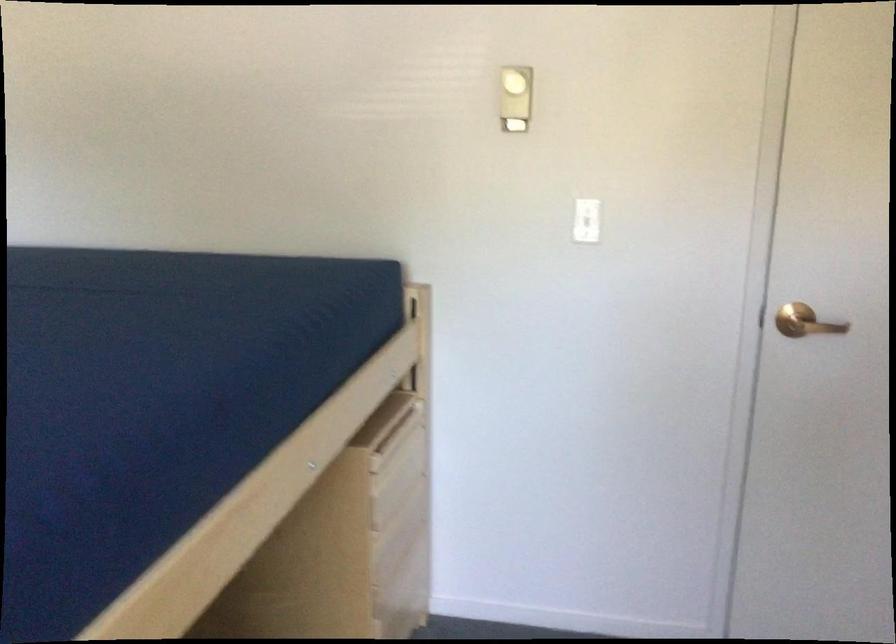
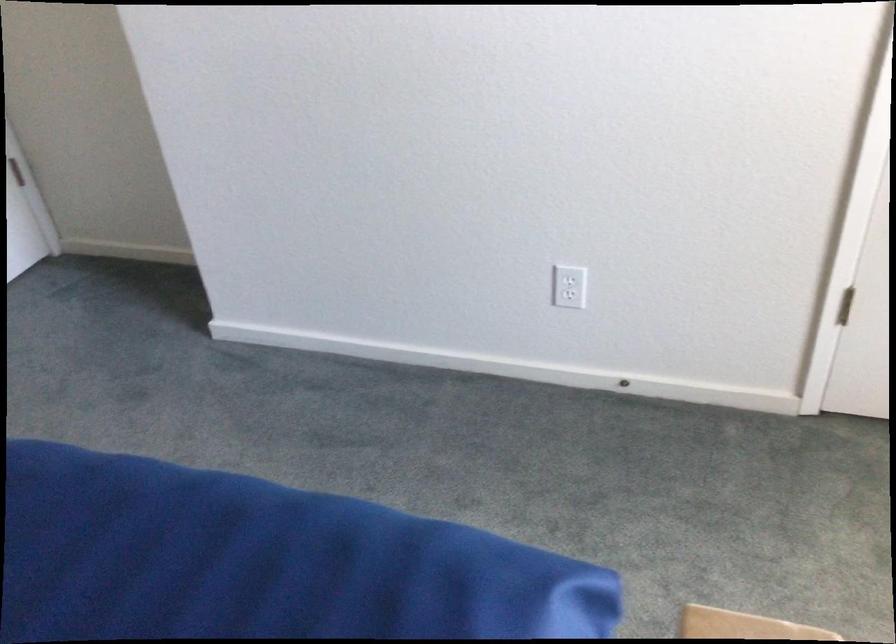
First-person continuous shooting, in which direction is the camera rotating?

The rotation direction of the camera is right-down.